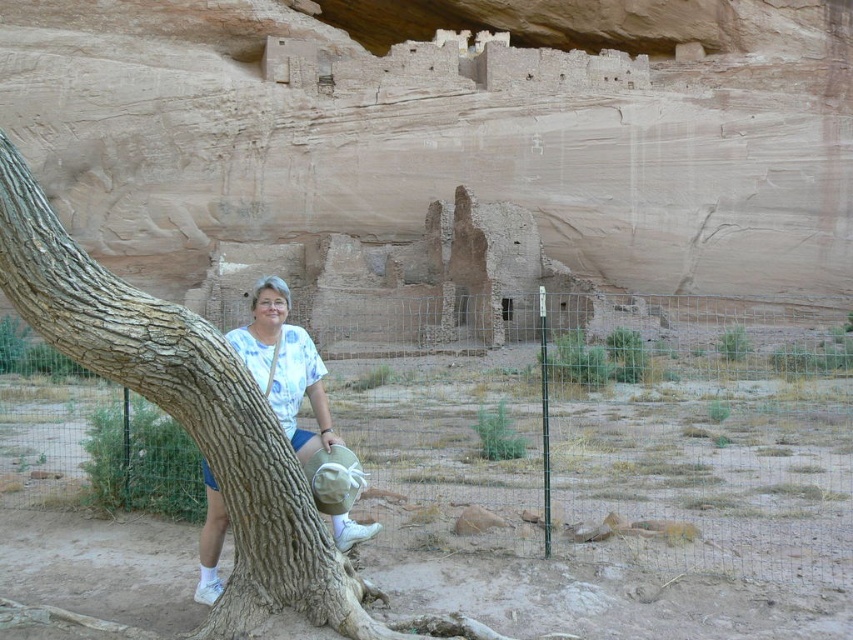
Question: Which of the following is the closest to the observer?

Choices:
 (A) brown rough bark tree at center
 (B) white cotton shirt at center

Answer: (A)

Question: Which object appears farthest from the camera in this image?

Choices:
 (A) white cotton shirt at center
 (B) brown rough bark tree at center

Answer: (A)

Question: Can you confirm if brown rough bark tree at center is positioned to the left of white cotton shirt at center?

Choices:
 (A) no
 (B) yes

Answer: (A)

Question: Which object appears closest to the camera in this image?

Choices:
 (A) brown rough bark tree at center
 (B) white cotton shirt at center

Answer: (A)

Question: Is brown rough bark tree at center to the right of white cotton shirt at center from the viewer's perspective?

Choices:
 (A) no
 (B) yes

Answer: (B)

Question: Does brown rough bark tree at center appear under white cotton shirt at center?

Choices:
 (A) no
 (B) yes

Answer: (B)